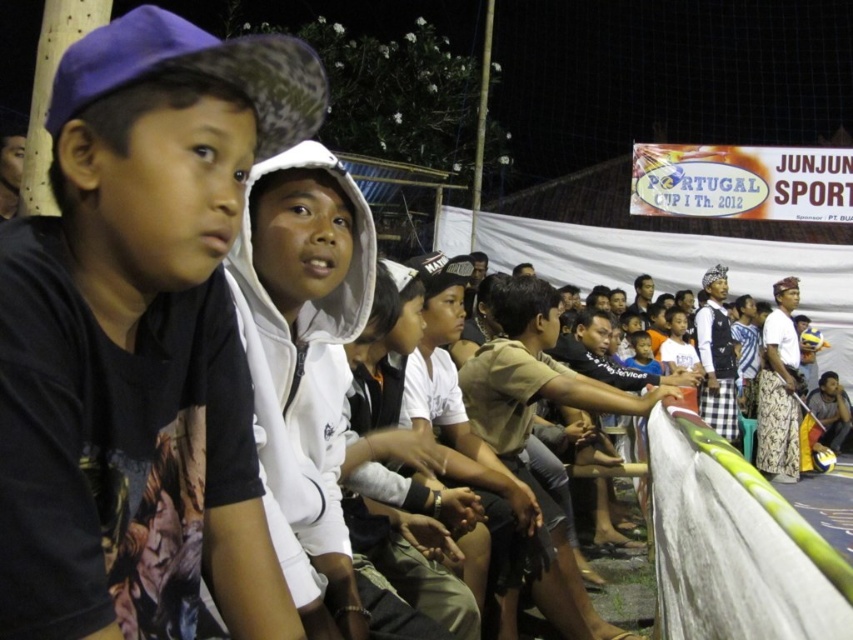
Question: From the image, what is the correct spatial relationship of black matte t-shirt at left in relation to white fleece jacket at center?

Choices:
 (A) above
 (B) below

Answer: (A)

Question: Can you confirm if black matte t-shirt at left is positioned to the left of white fleece jacket at center?

Choices:
 (A) yes
 (B) no

Answer: (A)

Question: Where is black matte t-shirt at left located in relation to white fleece jacket at center in the image?

Choices:
 (A) above
 (B) below

Answer: (A)

Question: Among these objects, which one is nearest to the camera?

Choices:
 (A) white fleece jacket at center
 (B) black matte t-shirt at left

Answer: (B)